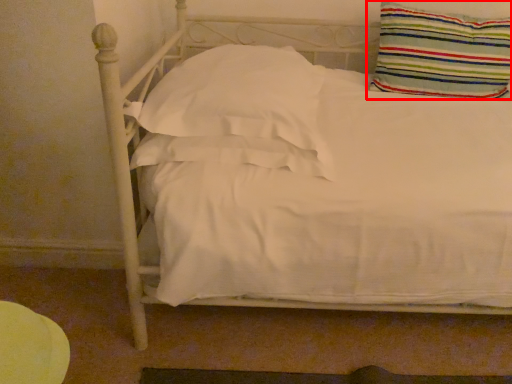
Question: From the image's perspective, where is pillow (annotated by the red box) located in relation to pillow in the image?

Choices:
 (A) below
 (B) above

Answer: (B)